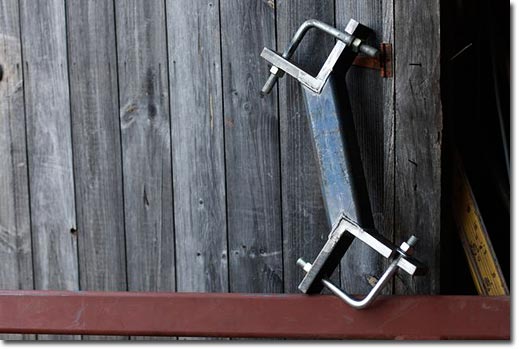
I want to click on v shape end of bar, so click(x=273, y=57), click(x=306, y=77), click(x=337, y=53), click(x=354, y=27), click(x=310, y=276), click(x=327, y=249), click(x=376, y=245), click(x=344, y=224), click(x=411, y=268).